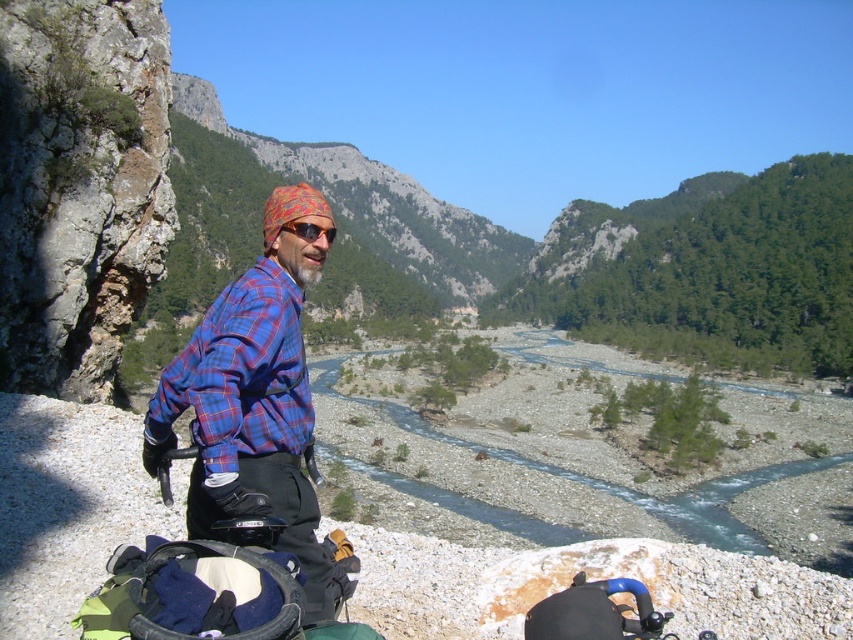
You are a hiker planning to take a photo of the blue plaid shirt at left and the matte orange goggles at center. Which object should you focus on first if you want to capture both in a single frame without moving the camera?

The blue plaid shirt at left is much taller than the matte orange goggles at center, so you should focus on the blue plaid shirt at left first to ensure both are in focus.

You are a photographer trying to capture the man in the blue plaid shirt at left and the matte orange goggles at center in a single frame. Given that your camera has a maximum focus range of 4 feet, can you fit both subjects into the frame without moving?

The distance between the blue plaid shirt at left and the matte orange goggles at center is 3.79 feet, which is within the camera maximum focus range of 4 feet. Therefore, you can fit both subjects into the frame without moving.

You are a photographer trying to capture a closeup of the blue plaid shirt at center and the matte orange goggles at center. Which object should you zoom in on to ensure both are in focus without moving the camera?

The blue plaid shirt at center is bigger than the matte orange goggles at center, so you should zoom in on the blue plaid shirt at center to ensure both are in focus without moving the camera.